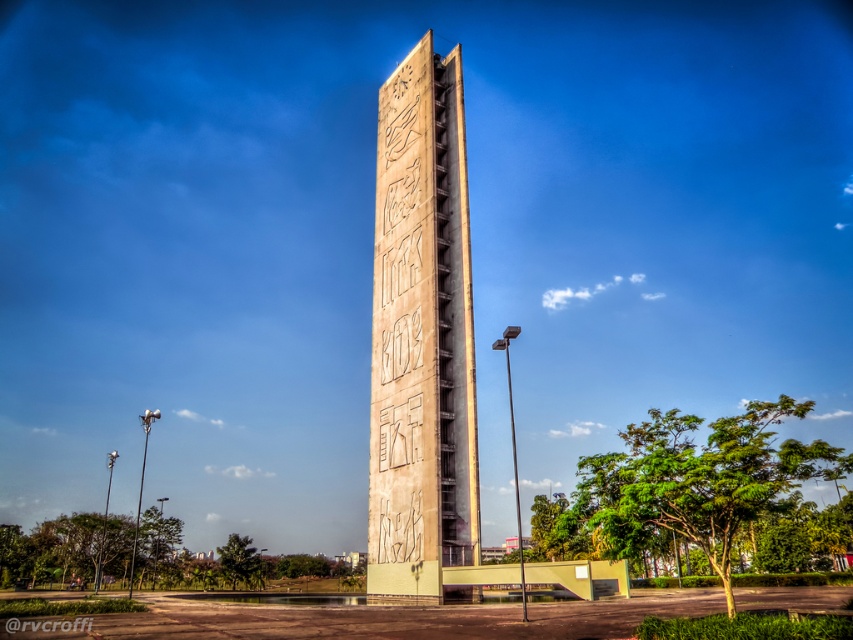
Does point (413, 81) come farther from viewer compared to point (76, 618)?

Yes, point (413, 81) is farther from viewer.

Measure the distance between beige concrete tower at center and camera.

A distance of 50.04 meters exists between beige concrete tower at center and camera.

Where is `beige concrete tower at center`? beige concrete tower at center is located at coordinates (421, 336).